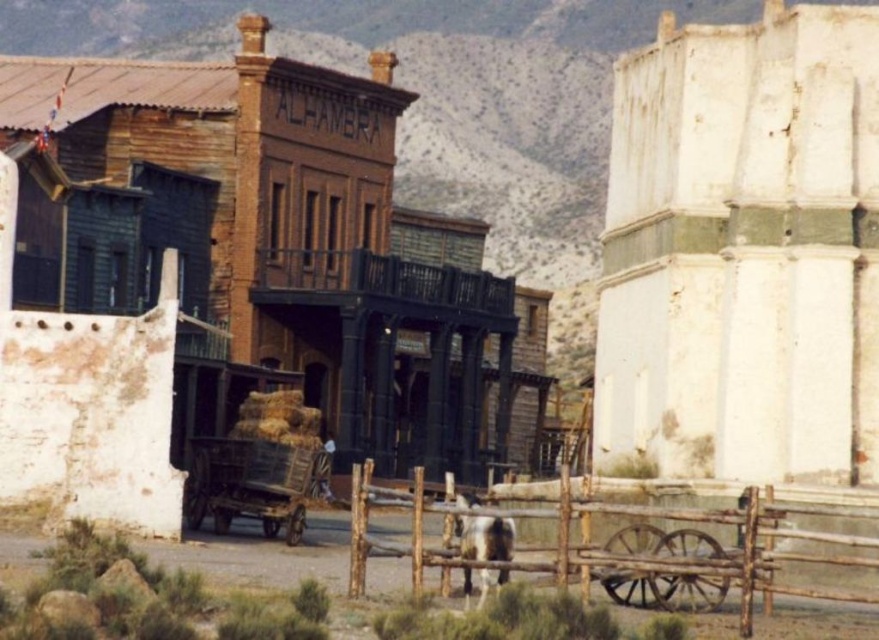
Question: Is rustic wooden building at center thinner than brown wooden fence at lower center?

Choices:
 (A) yes
 (B) no

Answer: (B)

Question: Which point is farther from the camera taking this photo?

Choices:
 (A) (273, 483)
 (B) (594, 564)
 (C) (98, 68)

Answer: (C)

Question: Is rustic wooden building at center above brown wooden fence at lower center?

Choices:
 (A) yes
 (B) no

Answer: (A)

Question: Which object is the closest to the brown wooden fence at lower center?

Choices:
 (A) rustic wooden building at center
 (B) wooden cart at center

Answer: (B)

Question: Is rustic wooden building at center wider than brown wooden fence at lower center?

Choices:
 (A) yes
 (B) no

Answer: (A)

Question: Which is farther from the rustic wooden building at center?

Choices:
 (A) brown wooden fence at lower center
 (B) wooden cart at center

Answer: (A)